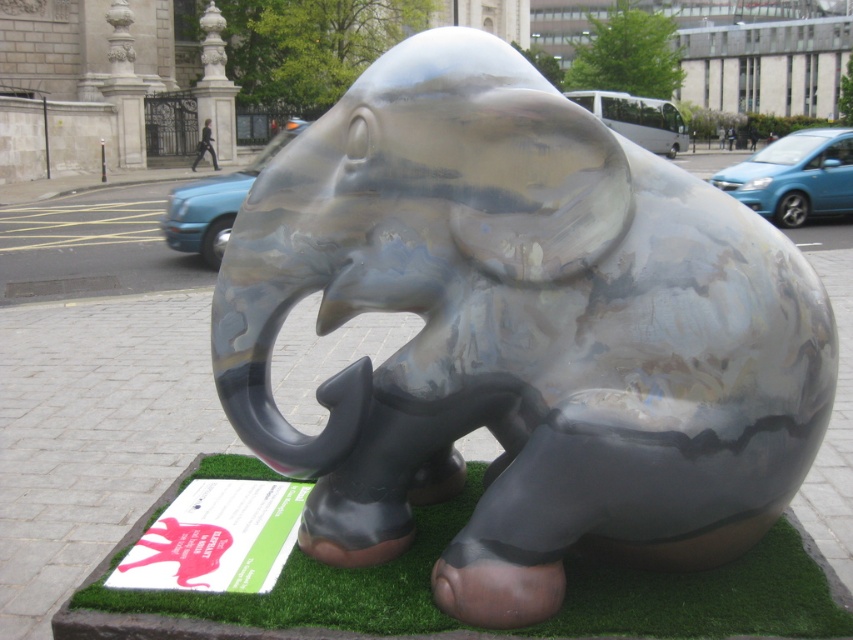
Question: Can you confirm if shiny metallic elephant at center is positioned to the left of green artificial turf at lower center?

Choices:
 (A) no
 (B) yes

Answer: (A)

Question: Is shiny metallic elephant at center to the right of green artificial turf at lower center from the viewer's perspective?

Choices:
 (A) no
 (B) yes

Answer: (B)

Question: Is shiny metallic elephant at center below green artificial turf at lower center?

Choices:
 (A) yes
 (B) no

Answer: (B)

Question: Which point appears closest to the camera in this image?

Choices:
 (A) (335, 596)
 (B) (259, 442)

Answer: (A)

Question: Which object is farther from the camera taking this photo?

Choices:
 (A) green artificial turf at lower center
 (B) shiny metallic elephant at center

Answer: (A)